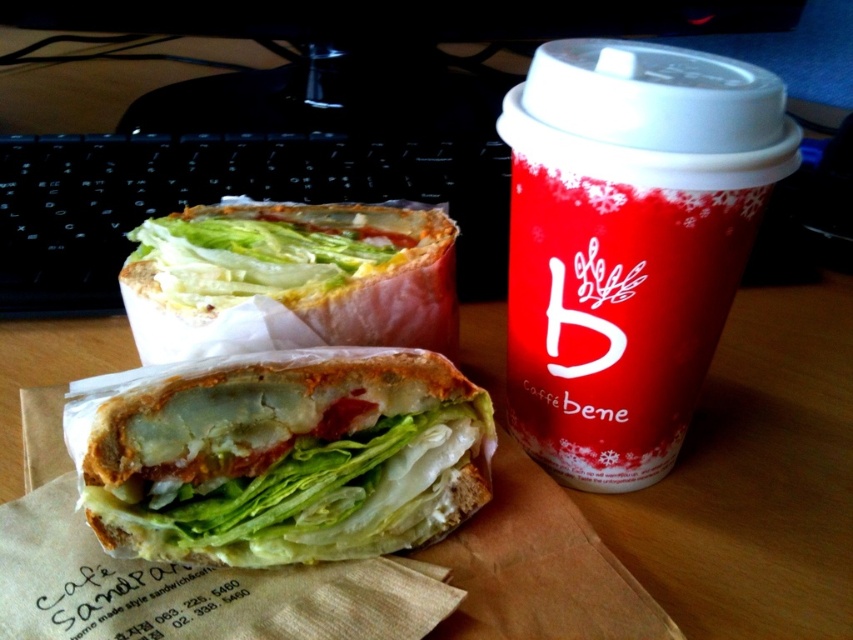
Question: Is red paper cup at upper right positioned behind matte white bread at center?

Choices:
 (A) no
 (B) yes

Answer: (A)

Question: Estimate the real-world distances between objects in this image. Which object is farther from the matte white sandwich at center?

Choices:
 (A) red paper cup at upper right
 (B) matte white bread at center

Answer: (A)

Question: Which point appears farthest from the camera in this image?

Choices:
 (A) (234, 442)
 (B) (154, 278)
 (C) (718, 67)

Answer: (B)

Question: Estimate the real-world distances between objects in this image. Which object is closer to the red paper cup at upper right?

Choices:
 (A) matte white bread at center
 (B) matte white sandwich at center

Answer: (A)

Question: Can you confirm if matte white sandwich at center is positioned below matte white bread at center?

Choices:
 (A) no
 (B) yes

Answer: (B)

Question: Is red paper cup at upper right thinner than matte white sandwich at center?

Choices:
 (A) no
 (B) yes

Answer: (B)